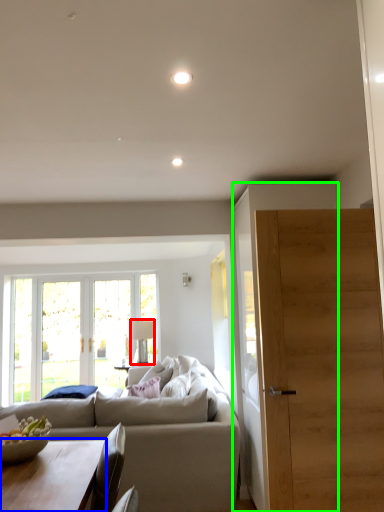
Question: Based on their relative distances, which object is nearer to lamp (highlighted by a red box)? Choose from coffee table (highlighted by a blue box) and cabinetry (highlighted by a green box).

Choices:
 (A) coffee table
 (B) cabinetry

Answer: (B)